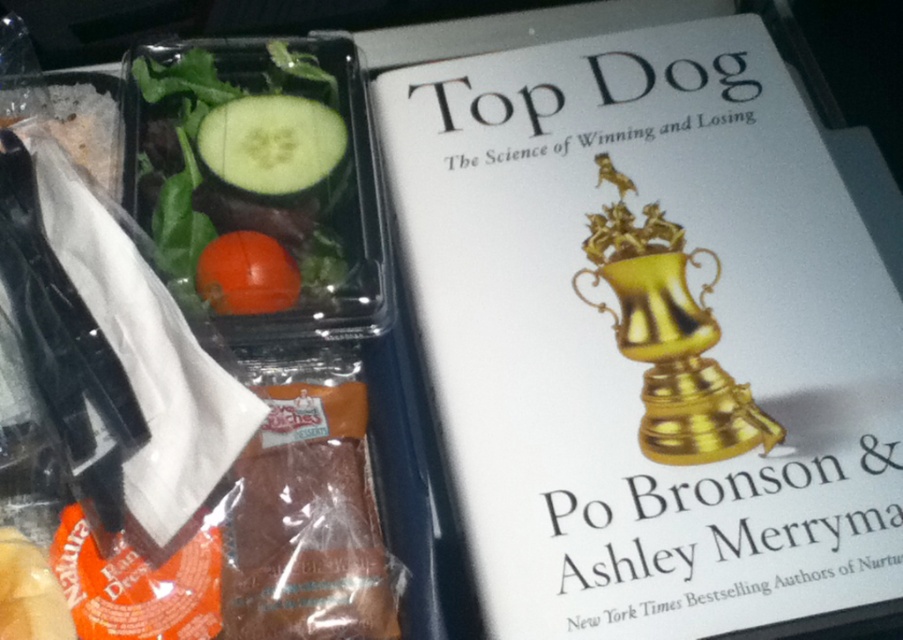
Between green matte cucumber at upper left and green matte cucumber at center, which one appears on the right side from the viewer's perspective?

From the viewer's perspective, green matte cucumber at center appears more on the right side.

Between green matte cucumber at upper left and green matte cucumber at center, which one is positioned higher?

green matte cucumber at center is above.

This screenshot has width=903, height=640. What are the coordinates of `green matte cucumber at upper left` in the screenshot? It's located at (243, 166).

Image resolution: width=903 pixels, height=640 pixels. What are the coordinates of `green matte cucumber at upper left` in the screenshot? It's located at (243, 166).

Is green matte cucumber at upper left smaller than glossy orange tomato at center-left?

No, green matte cucumber at upper left is not smaller than glossy orange tomato at center-left.

Can you confirm if green matte cucumber at upper left is thinner than glossy orange tomato at center-left?

Incorrect, green matte cucumber at upper left's width is not less than glossy orange tomato at center-left's.

Does point (306, 298) lie behind point (239, 314)?

Yes, point (306, 298) is farther from viewer.

Image resolution: width=903 pixels, height=640 pixels. In order to click on green matte cucumber at upper left in this screenshot , I will do `click(243, 166)`.

Who is lower down, green matte cucumber at center or glossy orange tomato at center-left?

Positioned lower is glossy orange tomato at center-left.

Who is higher up, green matte cucumber at center or glossy orange tomato at center-left?

green matte cucumber at center

Who is more forward, (284, 182) or (244, 266)?

Point (244, 266) is more forward.

This screenshot has height=640, width=903. In order to click on green matte cucumber at center in this screenshot , I will do `click(271, 144)`.